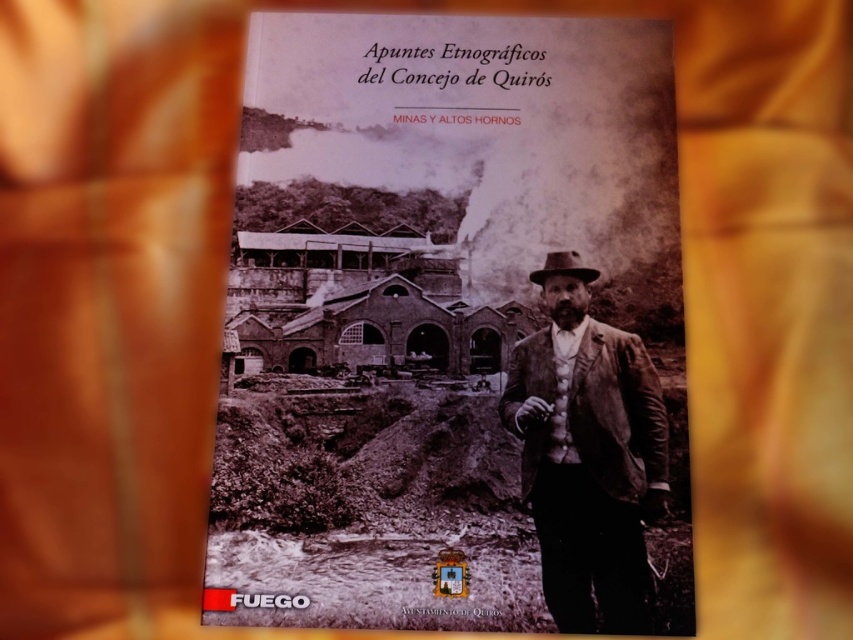
What are the coordinates of the sepia paper book cover at center?

The coordinates of the sepia paper book cover at center are at point (444,321).